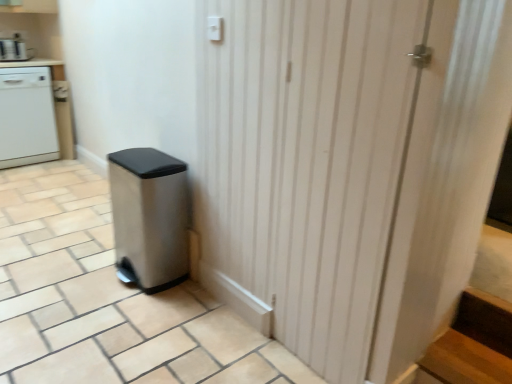
Question: Based on their positions, is satin silver trash can at lower left located to the left or right of white wood screen door at center?

Choices:
 (A) right
 (B) left

Answer: (B)

Question: Considering the positions of satin silver trash can at lower left and white wood screen door at center in the image, is satin silver trash can at lower left bigger or smaller than white wood screen door at center?

Choices:
 (A) big
 (B) small

Answer: (A)

Question: Based on their relative distances, which object is farther from the white wood screen door at center?

Choices:
 (A) brushed metal coffee maker at upper left
 (B) white glossy dishwasher at left
 (C) stainless steel trash can at lower left
 (D) satin silver trash can at lower left

Answer: (A)

Question: Which object is the closest to the white wood screen door at center?

Choices:
 (A) brushed metal coffee maker at upper left
 (B) satin silver trash can at lower left
 (C) stainless steel trash can at lower left
 (D) white glossy dishwasher at left

Answer: (C)